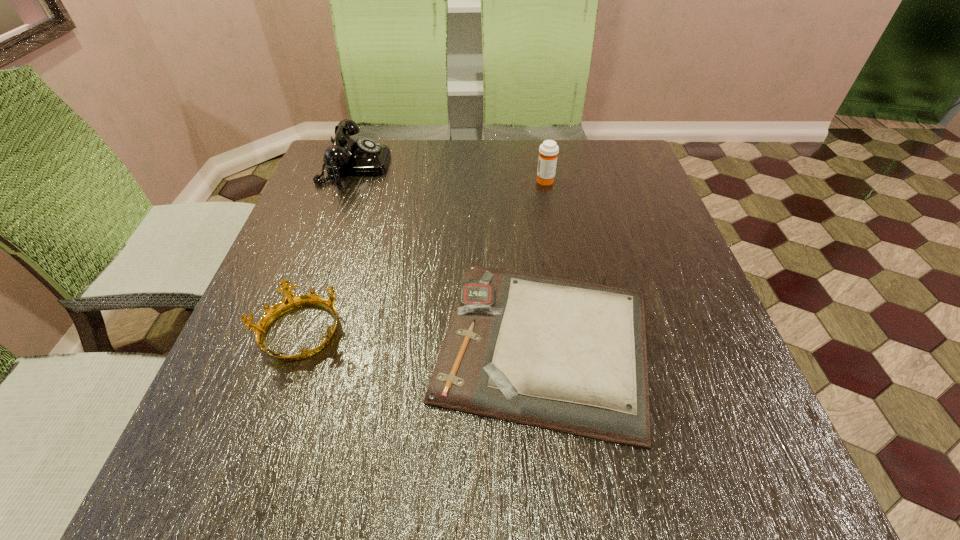
Find the location of a particular element. medicine is located at coordinates (548, 151).

What are the coordinates of `telephone` in the screenshot? It's located at (346, 157).

Find the location of a particular element. crown is located at coordinates (290, 301).

The width and height of the screenshot is (960, 540). Find the location of `clipboard`. clipboard is located at coordinates coord(570,356).

The image size is (960, 540). Identify the location of free space located 0.190m on the front of the medicine. tap(555, 232).

This screenshot has width=960, height=540. In order to click on free space located 0.310m on the dial of the telephone in this screenshot , I will do `click(498, 165)`.

This screenshot has height=540, width=960. Identify the location of vacant space located 0.270m on the right of the third tallest object. (485, 333).

This screenshot has height=540, width=960. What are the coordinates of `vacant region located 0.150m on the back of the clipboard` in the screenshot? It's located at (530, 224).

Identify the location of medicine that is at the far edge. Image resolution: width=960 pixels, height=540 pixels. (548, 151).

Identify the location of telephone situated at the far edge. This screenshot has width=960, height=540. (346, 157).